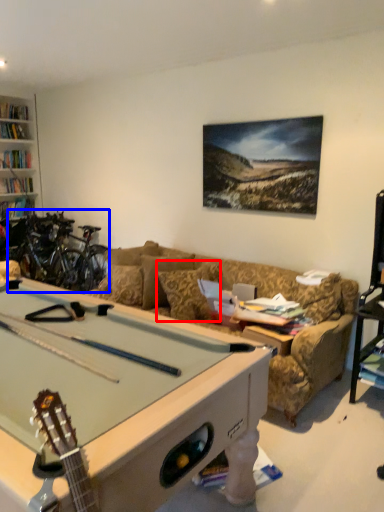
Question: Which point is further to the camera, pillow (highlighted by a red box) or bicycle (highlighted by a blue box)?

Choices:
 (A) pillow
 (B) bicycle

Answer: (B)